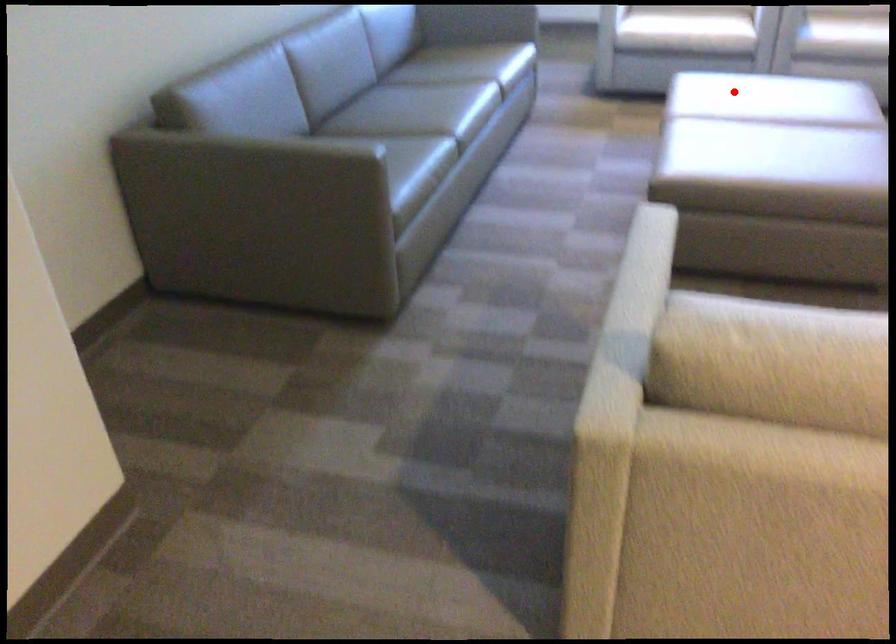
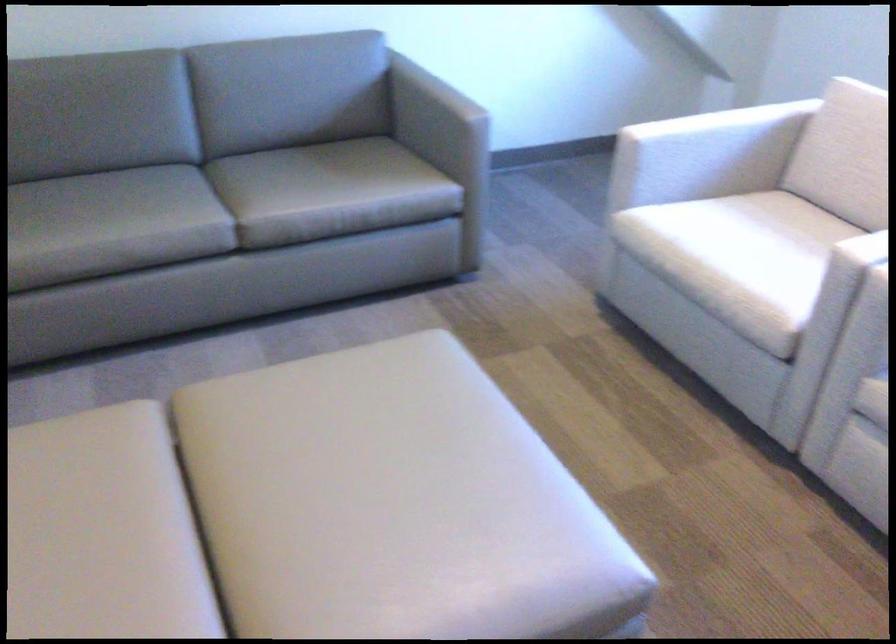
Find the pixel in the second image that matches the highlighted location in the first image.

(348, 446)